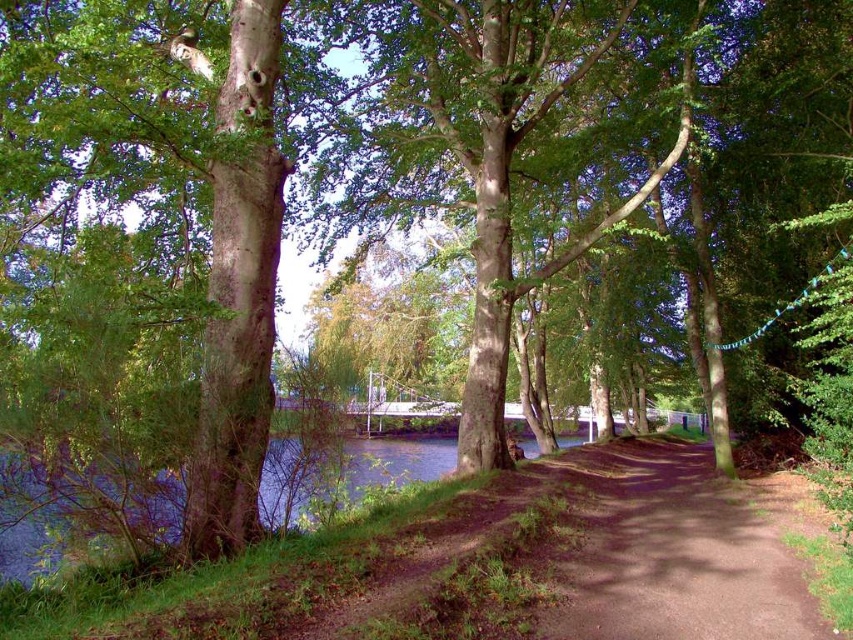
In the scene shown: Is green leafy tree at center closer to camera compared to brown dirt path at center?

No, it is not.

Find the location of a particular element. This screenshot has height=640, width=853. green leafy tree at center is located at coordinates (489, 147).